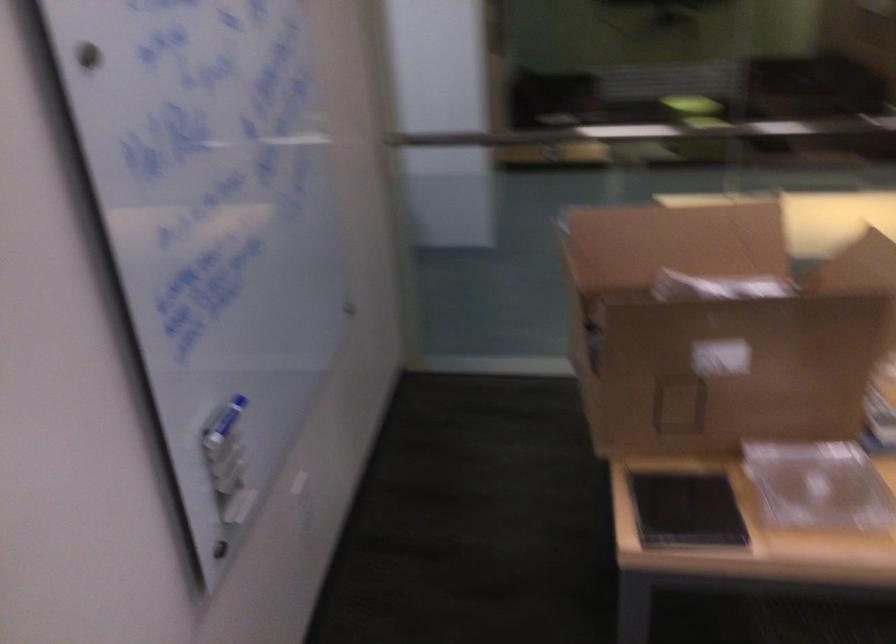
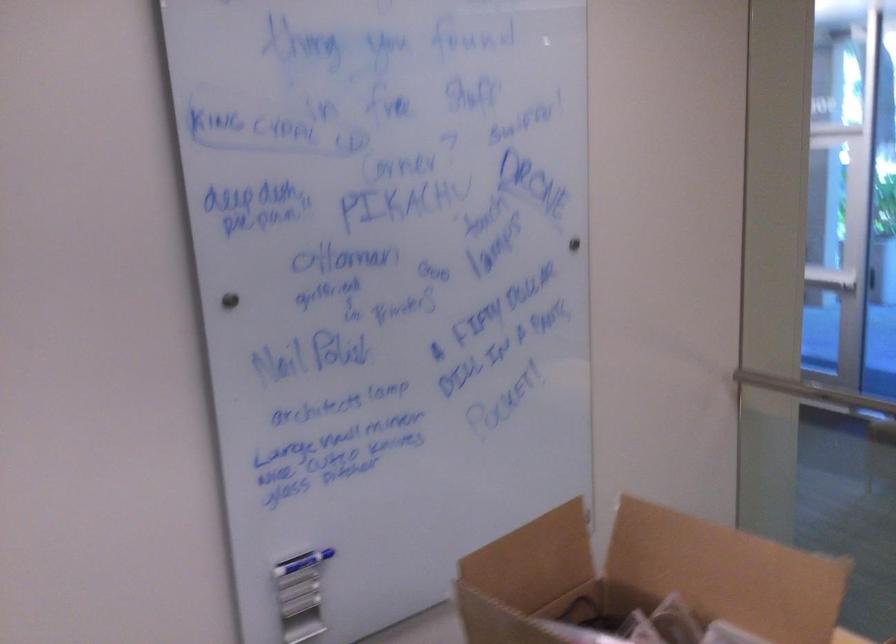
In the second image, find the point that corresponds to [220,418] in the first image.

(302, 562)